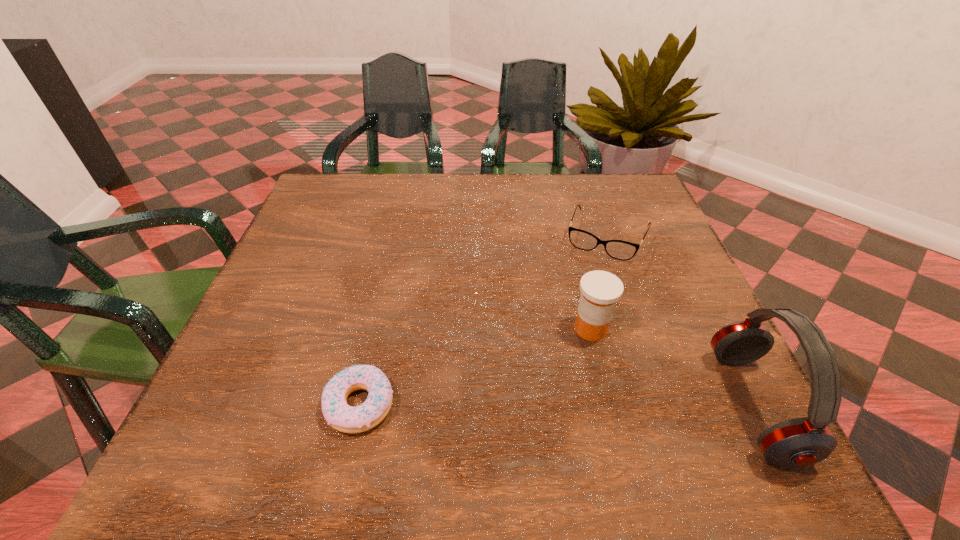
You are a GUI agent. You are given a task and a screenshot of the screen. Output one action in this format:
    pyautogui.click(x=<x>, y=<y>)
    Task: Click on the spectacles that is at the right edge
    Image resolution: width=960 pixels, height=540 pixels.
    Given the screenshot: What is the action you would take?
    pyautogui.click(x=618, y=249)

Where is `object present at the far right corner`? The height and width of the screenshot is (540, 960). object present at the far right corner is located at coordinates (618, 249).

I want to click on object that is at the near right corner, so click(x=799, y=442).

The width and height of the screenshot is (960, 540). In the image, there is a desktop. Find the location of `vacant area at the far edge`. vacant area at the far edge is located at coordinates (457, 204).

Where is `blank space at the left edge of the desktop`? blank space at the left edge of the desktop is located at coordinates (320, 318).

In the image, there is a desktop. In order to click on vacant space at the right edge in this screenshot , I will do `click(691, 305)`.

Identify the location of vacant space at the near left corner of the desktop. (266, 404).

Where is `vacant area at the far right corner`? The image size is (960, 540). vacant area at the far right corner is located at coordinates (619, 208).

I want to click on vacant space at the near right corner of the desktop, so click(x=729, y=372).

I want to click on empty location between the farthest object and the leftmost object, so click(484, 321).